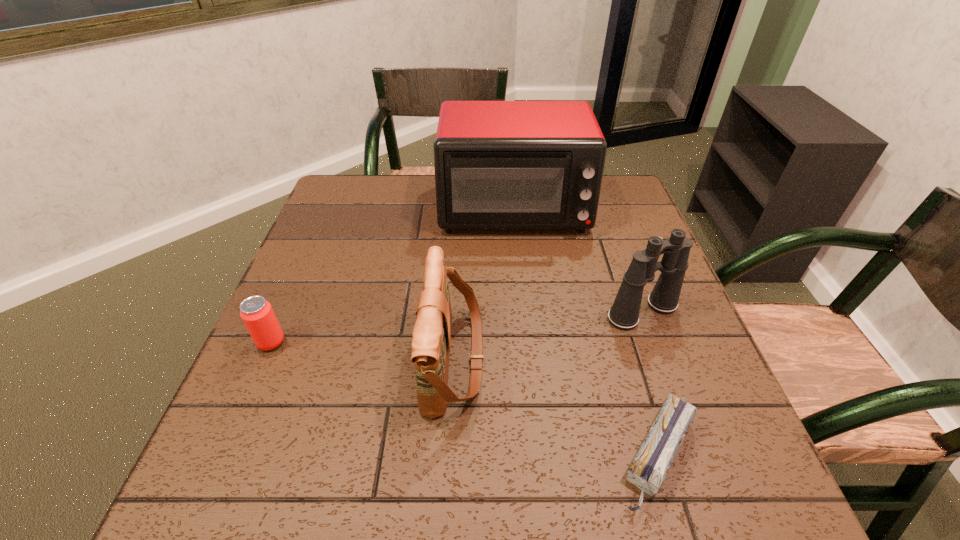
The height and width of the screenshot is (540, 960). In order to click on vacant space at the far edge of the desktop in this screenshot , I will do `click(412, 189)`.

In the image, there is a desktop. Find the location of `vacant space at the left edge`. vacant space at the left edge is located at coordinates (335, 221).

This screenshot has width=960, height=540. I want to click on vacant space at the right edge, so click(657, 327).

Where is `vacant area at the far left corner of the desktop`? The image size is (960, 540). vacant area at the far left corner of the desktop is located at coordinates (373, 190).

Locate an element on the screen. empty space that is in between the toaster oven and the leftmost object is located at coordinates (393, 275).

Find the location of a particular element. The width and height of the screenshot is (960, 540). free space between the beer can and the farthest object is located at coordinates [x=393, y=275].

The height and width of the screenshot is (540, 960). I want to click on unoccupied position between the shoulder bag and the leftmost object, so click(363, 350).

Find the location of a particular element. The image size is (960, 540). free point between the toaster oven and the pencil box is located at coordinates (586, 332).

At what (x,y) coordinates should I click in order to perform the action: click on free space between the binoculars and the beer can. Please return your answer as a coordinate pair (x, y). Looking at the image, I should click on (457, 327).

Where is `vacant space in between the shortest object and the shoulder bag`? Image resolution: width=960 pixels, height=540 pixels. vacant space in between the shortest object and the shoulder bag is located at coordinates [x=556, y=407].